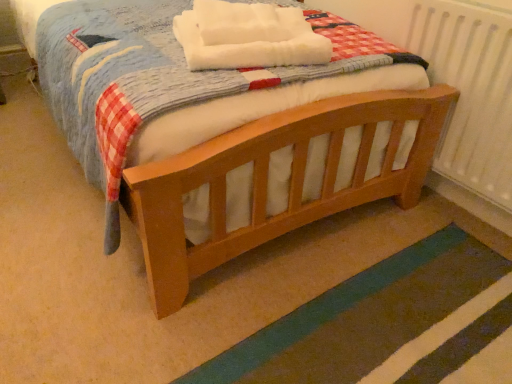
Describe the element at coordinates (247, 36) in the screenshot. I see `white soft blanket at center` at that location.

The height and width of the screenshot is (384, 512). Describe the element at coordinates (275, 166) in the screenshot. I see `wooden bed at center` at that location.

The width and height of the screenshot is (512, 384). I want to click on white soft blanket at center, so click(247, 36).

Considering the sizes of objects teal rug at lower right and white textured radiator at right in the image provided, who is shorter, teal rug at lower right or white textured radiator at right?

With less height is teal rug at lower right.

Locate an element on the screen. strip that appears on the left of white textured radiator at right is located at coordinates (361, 317).

Between teal rug at lower right and white textured radiator at right, which one has smaller width?

Thinner between the two is white textured radiator at right.

Does point (294, 323) appear closer or farther from the camera than point (482, 45)?

Point (294, 323) is positioned closer to the camera compared to point (482, 45).

Can you confirm if white textured radiator at right is bigger than white soft blanket at center?

Yes, white textured radiator at right is bigger than white soft blanket at center.

Is white textured radiator at right turned away from white soft blanket at center?

No, white soft blanket at center is not at the back of white textured radiator at right.

Considering their positions, is white textured radiator at right located in front of or behind white soft blanket at center?

In the image, white textured radiator at right appears in front of white soft blanket at center.

You are a GUI agent. You are given a task and a screenshot of the screen. Output one action in this format:
    pyautogui.click(x=<x>, y=<y>)
    Task: Click on the blanket lying on the left of white textured radiator at right
    
    Given the screenshot: What is the action you would take?
    pyautogui.click(x=247, y=36)

Who is shorter, teal rug at lower right or wooden bed at center?

Standing shorter between the two is wooden bed at center.

Visually, is teal rug at lower right positioned to the left or to the right of wooden bed at center?

Based on their positions, teal rug at lower right is located to the right of wooden bed at center.

From the image's perspective, which one is positioned lower, teal rug at lower right or wooden bed at center?

teal rug at lower right is shown below in the image.

Is point (457, 234) more distant than point (26, 27)?

No, (457, 234) is closer to viewer.

Considering the positions of objects wooden bed at center and teal rug at lower right in the image provided, who is more to the right, wooden bed at center or teal rug at lower right?

From the viewer's perspective, teal rug at lower right appears more on the right side.

Which of these two, wooden bed at center or teal rug at lower right, stands shorter?

With less height is wooden bed at center.

Considering the sizes of wooden bed at center and teal rug at lower right in the image, is wooden bed at center bigger or smaller than teal rug at lower right?

In the image, wooden bed at center appears to be larger than teal rug at lower right.

From the image's perspective, who appears lower, teal rug at lower right or white soft blanket at center?

teal rug at lower right is shown below in the image.

Which is closer to the camera, (275, 374) or (208, 1)?

Point (275, 374) is positioned closer to the camera compared to point (208, 1).

Is teal rug at lower right closer to the viewer compared to white soft blanket at center?

Yes, teal rug at lower right is closer to the camera.

Does teal rug at lower right have a lesser width compared to white soft blanket at center?

No, teal rug at lower right is not thinner than white soft blanket at center.

Is point (274, 18) positioned after point (415, 3)?

No, (274, 18) is in front of (415, 3).

At what (x,y) coordinates should I click in order to perform the action: click on blanket on the left of white textured radiator at right. Please return your answer as a coordinate pair (x, y). This screenshot has width=512, height=384. Looking at the image, I should click on 247,36.

From a real-world perspective, which is physically above, white soft blanket at center or white textured radiator at right?

white soft blanket at center.

Which object is more forward, white soft blanket at center or white textured radiator at right?

white textured radiator at right is closer to the camera.

Is wooden bed at center taller than white textured radiator at right?

No.

Identify the location of bed on the left of white textured radiator at right. The image size is (512, 384). (275, 166).

From a real-world perspective, is wooden bed at center on white textured radiator at right?

No, from a real-world perspective, wooden bed at center is not over white textured radiator at right

Is wooden bed at center surrounding white textured radiator at right?

That's incorrect, white textured radiator at right is not inside wooden bed at center.

This screenshot has height=384, width=512. What are the coordinates of `radiator located behind the teal rug at lower right` in the screenshot? It's located at (470, 91).

This screenshot has height=384, width=512. Identify the location of blanket on the left of white textured radiator at right. (247, 36).

Which object lies nearer to the anchor point white soft blanket at center, white textured radiator at right or teal rug at lower right?

white textured radiator at right is positioned closer to the anchor white soft blanket at center.

Which object lies further to the anchor point wooden bed at center, white soft blanket at center or white textured radiator at right?

white textured radiator at right.

Looking at the image, which one is located closer to white textured radiator at right, wooden bed at center or white soft blanket at center?

wooden bed at center is closer to white textured radiator at right.

Which object lies nearer to the anchor point white soft blanket at center, wooden bed at center or white textured radiator at right?

Based on the image, wooden bed at center appears to be nearer to white soft blanket at center.

Based on their spatial positions, is teal rug at lower right or wooden bed at center further from white soft blanket at center?

Based on the image, teal rug at lower right appears to be further to white soft blanket at center.

Based on their spatial positions, is teal rug at lower right or wooden bed at center closer to white textured radiator at right?

wooden bed at center is positioned closer to the anchor white textured radiator at right.

When comparing their distances from white textured radiator at right, does white soft blanket at center or wooden bed at center seem closer?

wooden bed at center is closer to white textured radiator at right.

Estimate the real-world distances between objects in this image. Which object is further from white soft blanket at center, white textured radiator at right or wooden bed at center?

white textured radiator at right is further to white soft blanket at center.

The image size is (512, 384). In order to click on bed between white soft blanket at center and teal rug at lower right from top to bottom in this screenshot , I will do [275, 166].

The width and height of the screenshot is (512, 384). I want to click on radiator between wooden bed at center and teal rug at lower right vertically, so click(470, 91).

This screenshot has height=384, width=512. Identify the location of bed between white soft blanket at center and white textured radiator at right. (275, 166).

Identify the location of radiator between white soft blanket at center and teal rug at lower right from top to bottom. Image resolution: width=512 pixels, height=384 pixels. (470, 91).